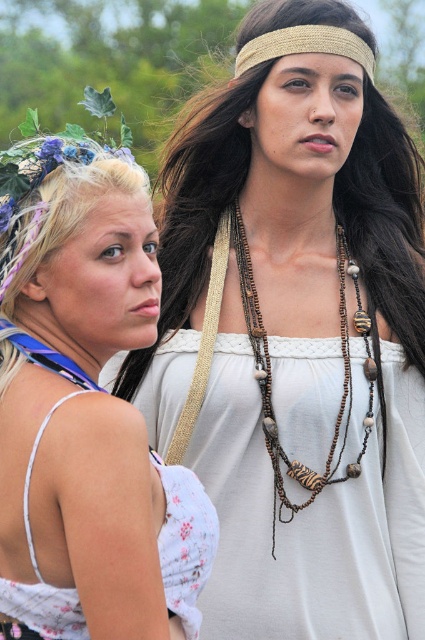
Question: Which point is farther to the camera?

Choices:
 (A) white floral dress at left
 (B) gold woven headband at upper center
 (C) brown beaded necklace at center

Answer: (B)

Question: Based on their relative distances, which object is nearer to the white floral dress at left?

Choices:
 (A) brown beaded necklace at center
 (B) white floral fabric dress at lower left
 (C) white floral dress at center
 (D) gold woven headband at upper center

Answer: (B)

Question: Can you confirm if white floral dress at center is positioned below brown beaded necklace at center?

Choices:
 (A) yes
 (B) no

Answer: (B)

Question: Is white floral dress at left further to camera compared to gold woven headband at upper center?

Choices:
 (A) no
 (B) yes

Answer: (A)

Question: Among these objects, which one is farthest from the camera?

Choices:
 (A) brown beaded necklace at center
 (B) gold woven headband at upper center

Answer: (B)

Question: Does white floral fabric dress at lower left have a greater width compared to gold woven headband at upper center?

Choices:
 (A) no
 (B) yes

Answer: (A)